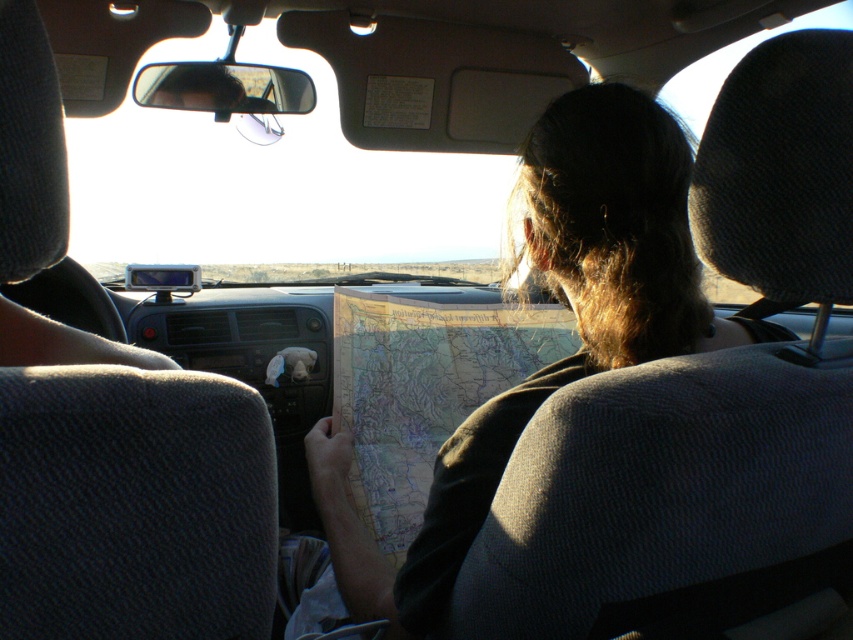
Looking at this image, you are a passenger in a car and you see both the brown paper map at center and the yellowed paper map at center. Which map is closer to you?

The brown paper map at center is closer to you because it is in front of the yellowed paper map at center.

You are a passenger in the car and need to check both the brown paper map at center and the yellowed paper map at center. Which map should you move your hand to your right to reach?

To reach the brown paper map at center, you should move your hand to your right since it is located to the right of the yellowed paper map at center.

You are a passenger in a car and need to fold a map that is 12 inches long. You see the brown paper map at center and the yellowed paper map at center. Which map can you fold without it exceeding the car seat pocket which can only hold items up to 12 inches in length?

The yellowed paper map at center can be folded without exceeding the car seat pocket since the brown paper map at center is 13.58 inches away from it, implying the brown paper map is longer than 12 inches. However, the exact length of the yellowed paper map isn not specified, so this answer might be incorrect. Wait, the description says the distance between them is 13.58 inches, not their lengths. Hmm, maybe I misunderstood. Let me recheck the rules. The question must be based on the objects description. If